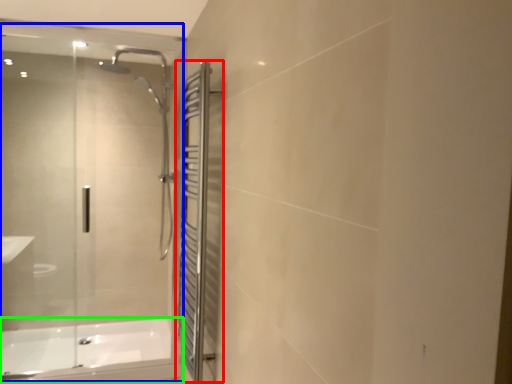
Question: Considering the real-world distances, which object is farthest from screen door (highlighted by a red box)? glass door (highlighted by a blue box) or bathtub (highlighted by a green box)?

Choices:
 (A) glass door
 (B) bathtub

Answer: (A)